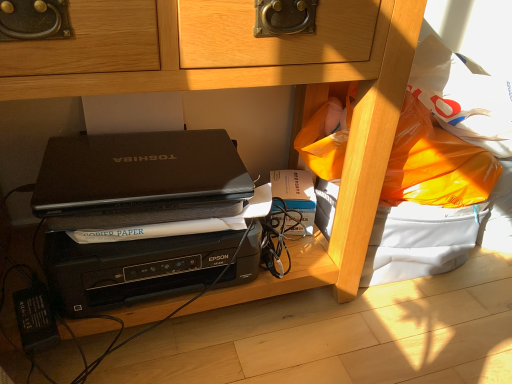
Question: Considering the positions of hardcover book at center and matte black laptop at center in the image, is hardcover book at center wider or thinner than matte black laptop at center?

Choices:
 (A) wide
 (B) thin

Answer: (B)

Question: Relative to matte black laptop at center, is hardcover book at center in front or behind?

Choices:
 (A) behind
 (B) front

Answer: (A)

Question: Which object is the closest to the matte black laptop at center?

Choices:
 (A) black matte laptop at center
 (B) hardcover book at center

Answer: (B)

Question: Considering the real-world distances, which object is closest to the matte black laptop at center?

Choices:
 (A) black matte laptop at center
 (B) hardcover book at center

Answer: (B)